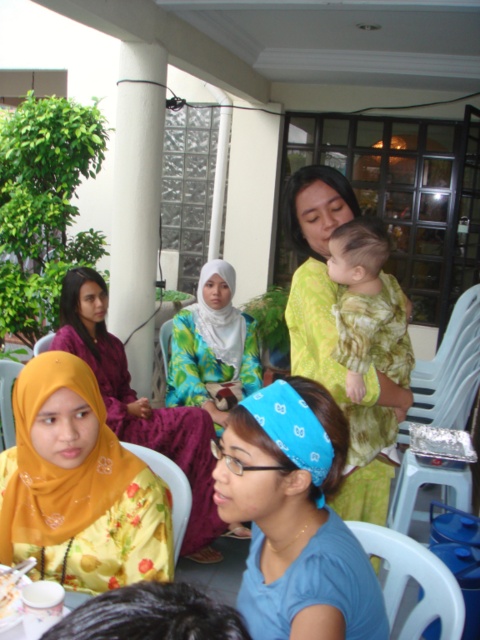
Question: Can you confirm if yellow floral dress at lower left is smaller than white satin headscarf at center?

Choices:
 (A) yes
 (B) no

Answer: (A)

Question: Does yellow floral dress at lower left appear on the left side of white porcelain cup at lower left?

Choices:
 (A) no
 (B) yes

Answer: (A)

Question: Is yellow satin hijab at center further to camera compared to white satin headscarf at center?

Choices:
 (A) yes
 (B) no

Answer: (B)

Question: Which object appears closest to the camera in this image?

Choices:
 (A) green textured cloth at center
 (B) blue fabric headscarf at center
 (C) yellow-green fabric baby at center
 (D) yellow satin hijab at center

Answer: (B)

Question: Estimate the real-world distances between objects in this image. Which object is closer to the green textured cloth at center?

Choices:
 (A) floral fabric hijab at center
 (B) yellow floral dress at lower left

Answer: (B)

Question: Which point is farther to the camera?

Choices:
 (A) white satin headscarf at center
 (B) floral fabric hijab at center
 (C) blue fabric headband at center
 (D) white porcelain cup at lower left

Answer: (A)